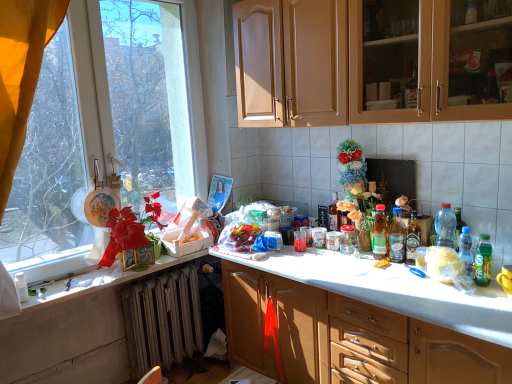
Locate an element on the screen. The height and width of the screenshot is (384, 512). free space on the front side of translucent glass bottle at center, which ranks as the 2th bottle in left-to-right order is located at coordinates (386, 264).